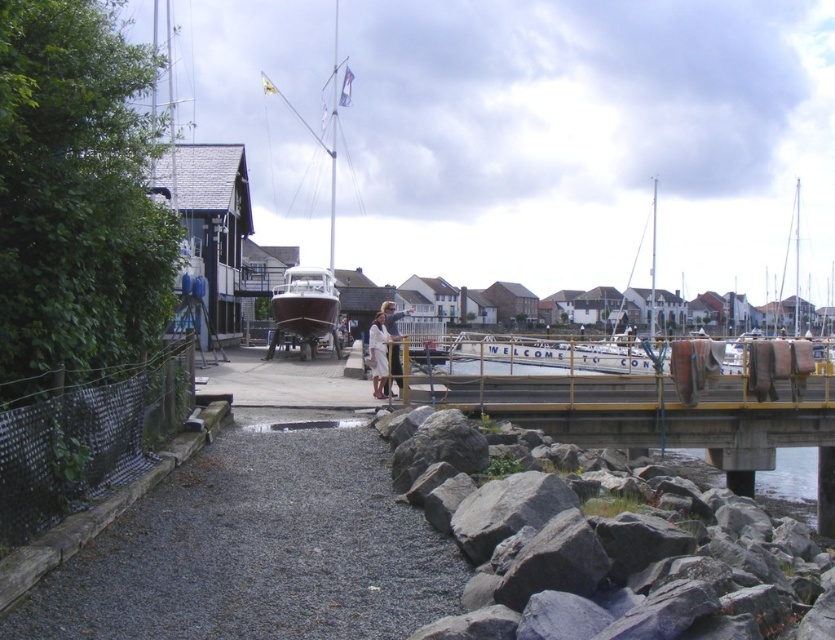
Question: Which object is closer to the camera taking this photo?

Choices:
 (A) white cotton dress at center
 (B) white fabric shirt at center

Answer: (A)

Question: Which object is the closest to the white cotton dress at center?

Choices:
 (A) white fabric shirt at center
 (B) matte brown boat at center

Answer: (A)

Question: Which object is the farthest from the white fabric shirt at center?

Choices:
 (A) matte brown boat at center
 (B) white cotton dress at center

Answer: (A)

Question: Considering the relative positions of matte brown boat at center and white fabric shirt at center in the image provided, where is matte brown boat at center located with respect to white fabric shirt at center?

Choices:
 (A) above
 (B) below

Answer: (A)

Question: Does matte brown boat at center appear under white cotton dress at center?

Choices:
 (A) no
 (B) yes

Answer: (A)

Question: Is matte brown boat at center to the left of white cotton dress at center from the viewer's perspective?

Choices:
 (A) yes
 (B) no

Answer: (A)